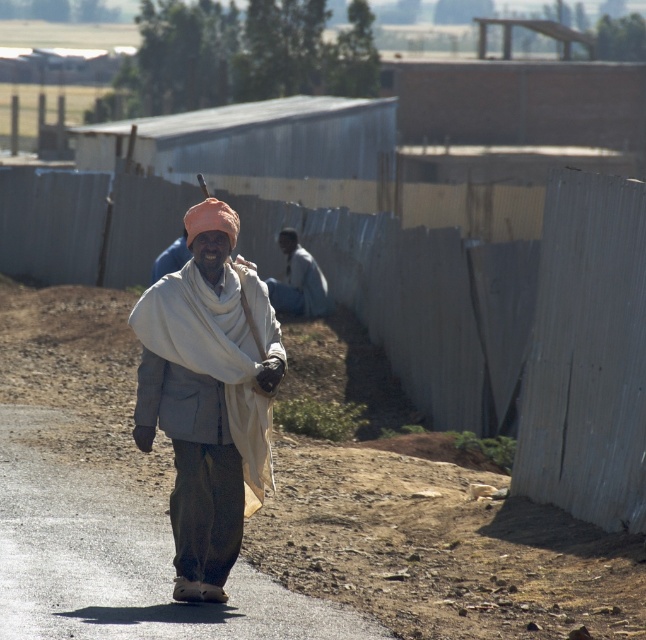
Which is behind, point (264, 320) or point (324, 278)?

Point (324, 278)

Is light brown fabric turban at center to the left of dark gray fabric at center from the viewer's perspective?

Correct, you'll find light brown fabric turban at center to the left of dark gray fabric at center.

Measure the distance between point (229, 230) and camera.

A distance of 9.72 meters exists between point (229, 230) and camera.

You are a GUI agent. You are given a task and a screenshot of the screen. Output one action in this format:
    pyautogui.click(x=<x>, y=<y>)
    Task: Click on the light brown fabric turban at center
    
    Given the screenshot: What is the action you would take?
    point(209,396)